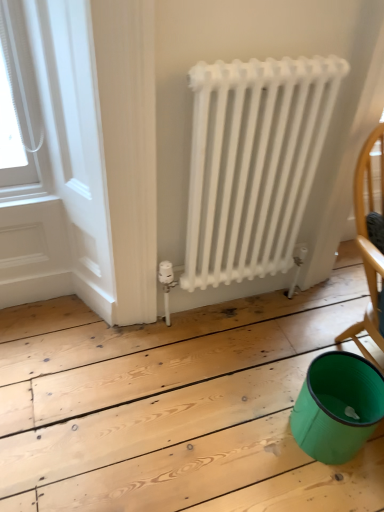
Question: Does wooden chair at right have a larger size compared to teal plastic bucket at lower right?

Choices:
 (A) no
 (B) yes

Answer: (A)

Question: Would you say wooden chair at right is outside teal plastic bucket at lower right?

Choices:
 (A) yes
 (B) no

Answer: (A)

Question: Is wooden chair at right thinner than teal plastic bucket at lower right?

Choices:
 (A) no
 (B) yes

Answer: (B)

Question: From a real-world perspective, is wooden chair at right on teal plastic bucket at lower right?

Choices:
 (A) yes
 (B) no

Answer: (A)

Question: Could you tell me if wooden chair at right is turned towards teal plastic bucket at lower right?

Choices:
 (A) yes
 (B) no

Answer: (B)

Question: Is teal plastic bucket at lower right at the back of wooden chair at right?

Choices:
 (A) yes
 (B) no

Answer: (B)

Question: Considering the relative sizes of white matte radiator at center and wooden chair at right in the image provided, is white matte radiator at center bigger than wooden chair at right?

Choices:
 (A) yes
 (B) no

Answer: (A)

Question: Would you say white matte radiator at center is a long distance from wooden chair at right?

Choices:
 (A) yes
 (B) no

Answer: (B)

Question: Is white matte radiator at center turned away from wooden chair at right?

Choices:
 (A) yes
 (B) no

Answer: (B)

Question: From a real-world perspective, is white matte radiator at center physically below wooden chair at right?

Choices:
 (A) no
 (B) yes

Answer: (B)

Question: Considering the relative positions of white matte radiator at center and wooden chair at right in the image provided, is white matte radiator at center to the right of wooden chair at right from the viewer's perspective?

Choices:
 (A) no
 (B) yes

Answer: (A)

Question: Can you confirm if white matte radiator at center is positioned to the left of wooden chair at right?

Choices:
 (A) no
 (B) yes

Answer: (B)

Question: From the image's perspective, is white matte radiator at center on top of white painted wood at upper left?

Choices:
 (A) no
 (B) yes

Answer: (B)